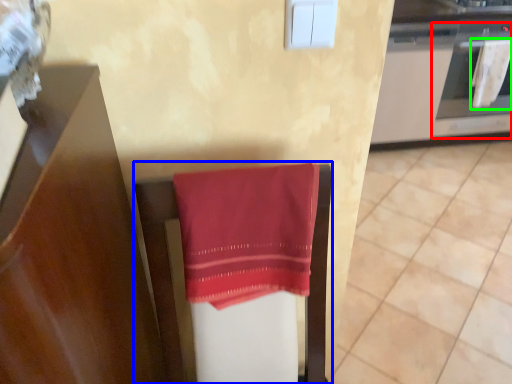
Question: Which object is the closest to the oven (highlighted by a red box)? Choose among these: furniture (highlighted by a blue box) or beach towel (highlighted by a green box).

Choices:
 (A) furniture
 (B) beach towel

Answer: (B)